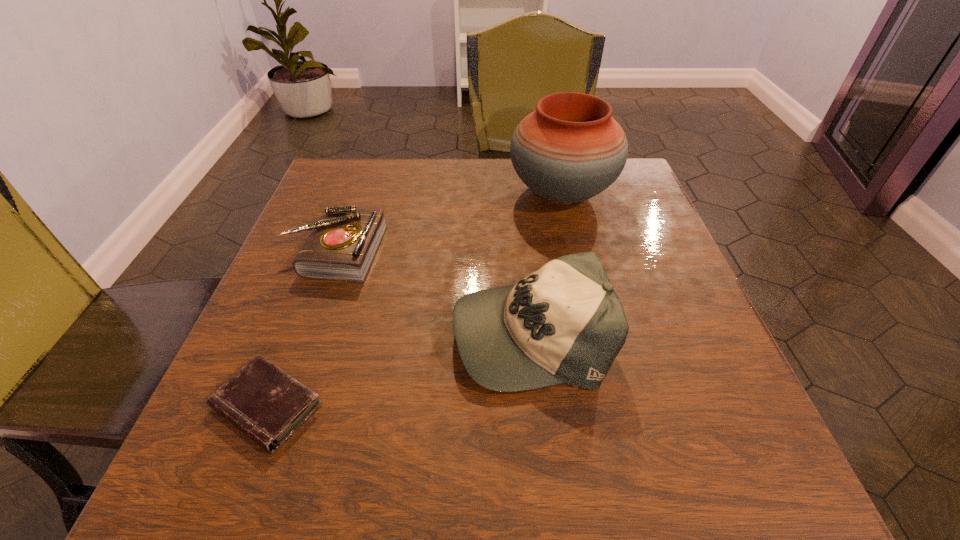
Find the location of a particular element. The height and width of the screenshot is (540, 960). vacant region located on the front of the third tallest object is located at coordinates (302, 341).

What are the coordinates of `vacant space located 0.050m on the right of the shorter diary` in the screenshot? It's located at (356, 406).

Identify the location of object that is at the far edge. (570, 149).

What are the coordinates of `object that is positioned at the near edge` in the screenshot? It's located at (261, 400).

This screenshot has width=960, height=540. I want to click on object present at the right edge, so click(570, 149).

What are the coordinates of `object positioned at the near left corner` in the screenshot? It's located at (261, 400).

This screenshot has height=540, width=960. I want to click on object that is positioned at the far right corner, so click(x=570, y=149).

Locate an element on the screen. The image size is (960, 540). vacant space at the far edge is located at coordinates (501, 160).

What are the coordinates of `free location at the near edge of the desktop` in the screenshot? It's located at (466, 456).

The height and width of the screenshot is (540, 960). What are the coordinates of `vacant space at the left edge of the desktop` in the screenshot? It's located at (344, 325).